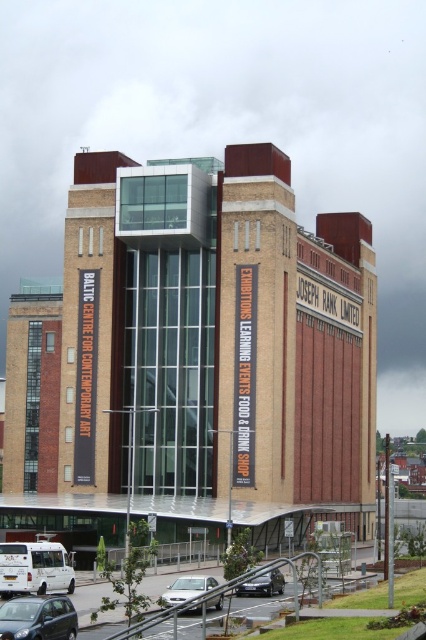
Question: Which is nearer to the metallic gray hatchback at lower left?

Choices:
 (A) silver metallic sedan at lower center
 (B) metallic silver van at center

Answer: (A)

Question: Is metallic gray hatchback at lower left in front of silver metallic sedan at lower center?

Choices:
 (A) yes
 (B) no

Answer: (A)

Question: Which of the following is the closest to the observer?

Choices:
 (A) (58, 628)
 (B) (259, 577)
 (C) (187, 598)

Answer: (A)

Question: Does silver metallic sedan at lower center appear under metallic silver van at center?

Choices:
 (A) yes
 (B) no

Answer: (A)

Question: Does metallic gray hatchback at lower left appear on the right side of silver metallic sedan at lower center?

Choices:
 (A) yes
 (B) no

Answer: (B)

Question: Which point is farther from the camera taking this photo?

Choices:
 (A) (25, 637)
 (B) (282, 577)
 (C) (161, 596)

Answer: (B)